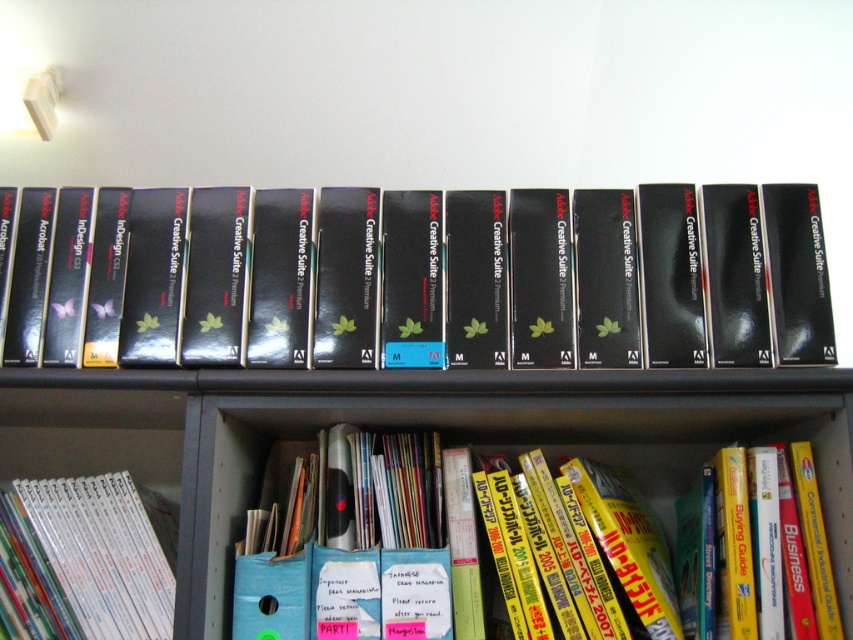
Question: Which is nearer to the yellow glossy book at lower center?

Choices:
 (A) white glossy book at lower left
 (B) black matte adobe creative suite premium at center

Answer: (B)

Question: Which object is positioned closest to the yellow glossy book at lower center?

Choices:
 (A) white glossy book at lower left
 (B) black matte adobe creative suite premium at center

Answer: (B)

Question: Where is yellow glossy book at lower center located in relation to white glossy book at lower left in the image?

Choices:
 (A) right
 (B) left

Answer: (A)

Question: Is black matte adobe creative suite premium at center below white glossy book at lower left?

Choices:
 (A) yes
 (B) no

Answer: (B)

Question: Estimate the real-world distances between objects in this image. Which object is farther from the black matte adobe creative suite premium at center?

Choices:
 (A) yellow glossy book at lower center
 (B) white glossy book at lower left

Answer: (B)

Question: Does black matte adobe creative suite premium at center appear on the left side of yellow glossy book at lower center?

Choices:
 (A) no
 (B) yes

Answer: (B)